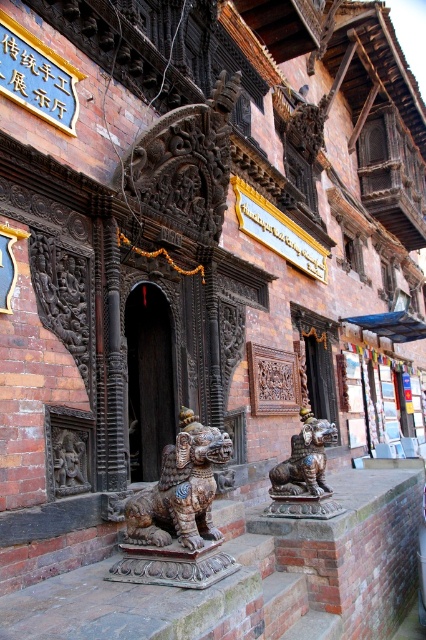
Question: Considering the real-world distances, which object is closest to the bronze/golden lion at center?

Choices:
 (A) black wood door at center
 (B) dark brown stone statue at lower left

Answer: (A)

Question: Is bronze/golden lion at center smaller than dark brown stone statue at lower left?

Choices:
 (A) no
 (B) yes

Answer: (A)

Question: Which of these objects is positioned farthest from the bronze/golden lion at center?

Choices:
 (A) bronze textured lion at center
 (B) black wood door at center
 (C) dark brown stone statue at lower left

Answer: (C)

Question: Is bronze textured lion at center to the left of black wood door at center from the viewer's perspective?

Choices:
 (A) no
 (B) yes

Answer: (A)

Question: Does bronze/golden lion at center appear on the left side of dark brown stone statue at lower left?

Choices:
 (A) no
 (B) yes

Answer: (A)

Question: Which of these objects is positioned farthest from the dark brown stone statue at lower left?

Choices:
 (A) black wood door at center
 (B) bronze textured lion at center
 (C) bronze/golden lion at center

Answer: (C)